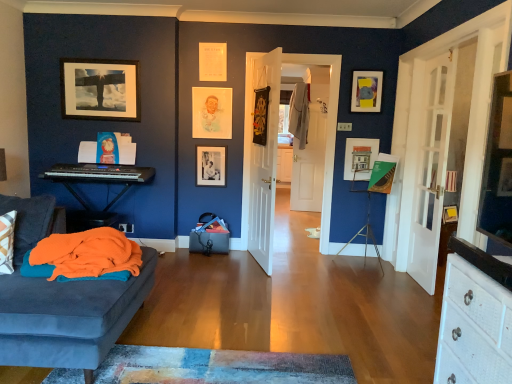
Question: Should I look upward or downward to see matte yellow and gray picture frame at upper right, acting as the first picture frame starting from the right?

Choices:
 (A) up
 (B) down

Answer: (A)

Question: Can you confirm if matte black picture frame at upper left, which is the 5th picture frame in right-to-left order, is taller than black plastic keyboard at left?

Choices:
 (A) no
 (B) yes

Answer: (B)

Question: Is matte black picture frame at upper left, which is the 5th picture frame in right-to-left order, not within black plastic keyboard at left?

Choices:
 (A) no
 (B) yes

Answer: (B)

Question: Is matte black picture frame at upper left, which is the 5th picture frame in right-to-left order, beside black plastic keyboard at left?

Choices:
 (A) no
 (B) yes

Answer: (A)

Question: Can you confirm if matte black picture frame at upper left, which is the 5th picture frame in right-to-left order, is bigger than black plastic keyboard at left?

Choices:
 (A) no
 (B) yes

Answer: (A)

Question: Can you confirm if matte black picture frame at upper left, which is the 5th picture frame in right-to-left order, is wider than black plastic keyboard at left?

Choices:
 (A) no
 (B) yes

Answer: (A)

Question: From the image's perspective, is matte black picture frame at upper left, which is the 5th picture frame in right-to-left order, on black plastic keyboard at left?

Choices:
 (A) no
 (B) yes

Answer: (B)

Question: Is matte yellow and gray picture frame at upper right, acting as the first picture frame starting from the right, directly adjacent to matte black picture frame at upper left, the first picture frame in the left-to-right sequence?

Choices:
 (A) yes
 (B) no

Answer: (B)

Question: Is matte yellow and gray picture frame at upper right, marked as the fifth picture frame in a left-to-right arrangement, at the right side of matte black picture frame at upper left, which is the 5th picture frame in right-to-left order?

Choices:
 (A) yes
 (B) no

Answer: (A)

Question: From the image's perspective, would you say matte yellow and gray picture frame at upper right, acting as the first picture frame starting from the right, is shown under matte black picture frame at upper left, which is the 5th picture frame in right-to-left order?

Choices:
 (A) no
 (B) yes

Answer: (A)

Question: From the image's perspective, does matte yellow and gray picture frame at upper right, acting as the first picture frame starting from the right, appear higher than matte black picture frame at upper left, the first picture frame in the left-to-right sequence?

Choices:
 (A) no
 (B) yes

Answer: (B)

Question: Is the depth of matte yellow and gray picture frame at upper right, acting as the first picture frame starting from the right, greater than that of matte black picture frame at upper left, the first picture frame in the left-to-right sequence?

Choices:
 (A) no
 (B) yes

Answer: (B)

Question: Does matte yellow and gray picture frame at upper right, acting as the first picture frame starting from the right, have a lesser width compared to matte black picture frame at upper left, the first picture frame in the left-to-right sequence?

Choices:
 (A) yes
 (B) no

Answer: (B)

Question: Can you confirm if matte yellow and gray picture frame at upper right, marked as the fifth picture frame in a left-to-right arrangement, is wider than black matte picture frame at center, positioned as the second picture frame in left-to-right order?

Choices:
 (A) no
 (B) yes

Answer: (B)